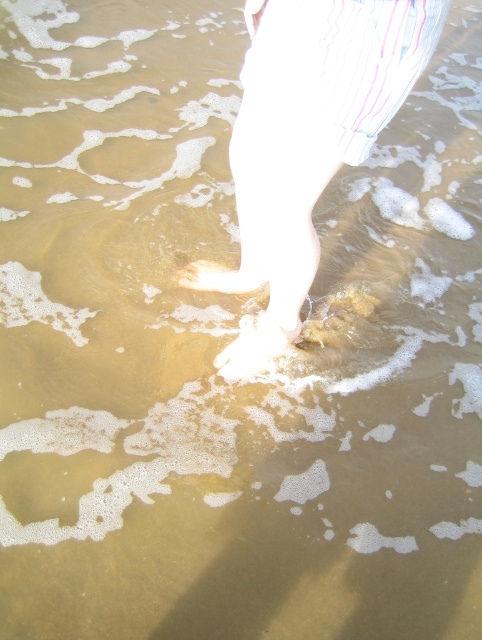
You are standing on a beach and see a white cotton leg at center. If you want to touch it, how many steps do you think you need to take forward?

The white cotton leg at center is 1.01 meters away from you. Assuming an average step length of about 0.75 meters, you would need to take 2 steps forward to reach it.

Based on the scene description, where is the white matte sand at center located in the image?

The white matte sand at center is located at point coordinates of (254, 346).